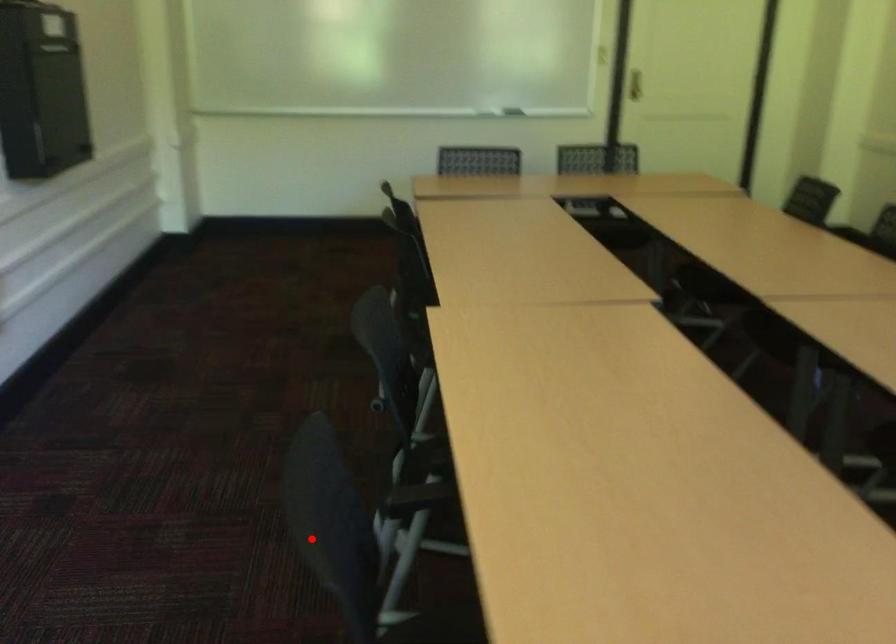
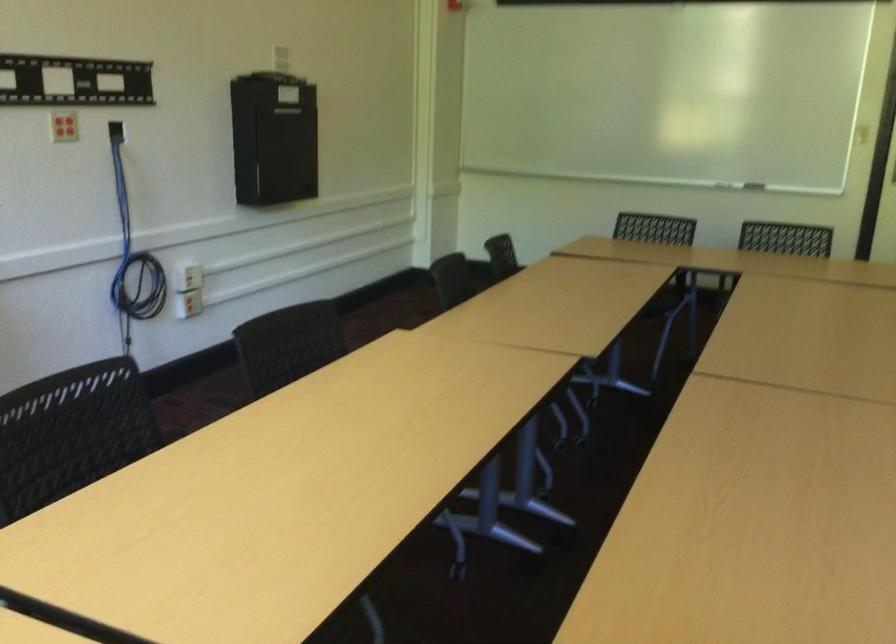
Question: A red point is marked in image1. In image2, is the corresponding 3D point closer to the camera or farther? Reply with the corresponding letter.

Choices:
 (A) The corresponding 3D point is closer.
 (B) The corresponding 3D point is farther.

Answer: (B)